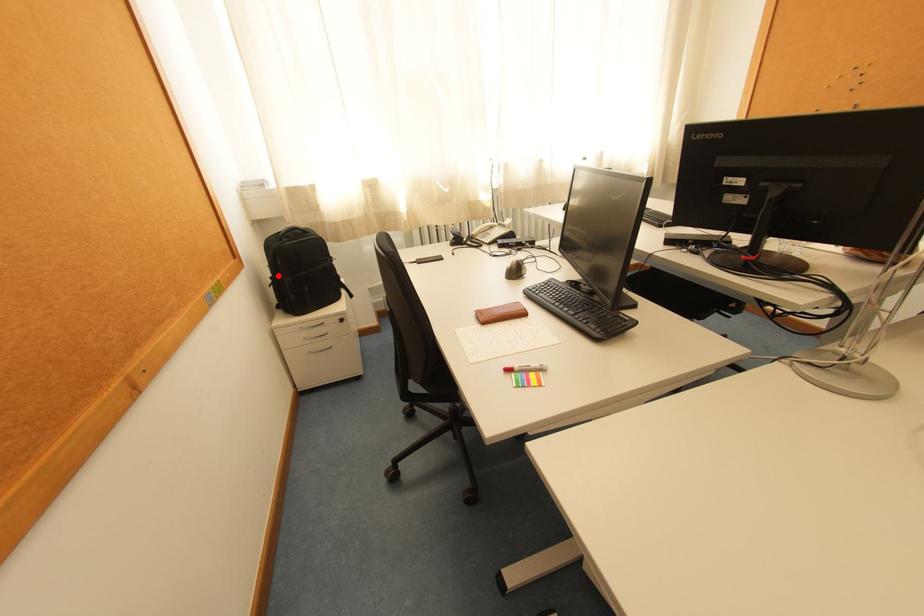
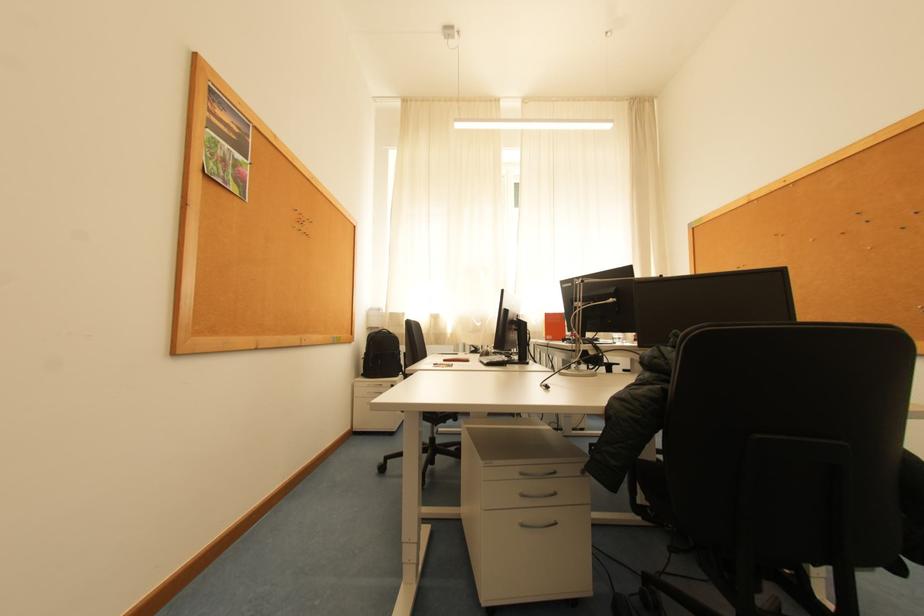
Question: I am providing you with two images of the same scene from different viewpoints. Given a red point in image1, look at the same physical point in image2. Is it:

Choices:
 (A) Closer to the viewpoint
 (B) Farther from the viewpoint

Answer: (B)